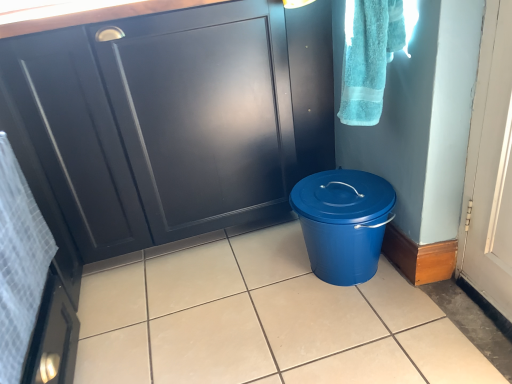
Where is `vacant region to the left of blue plastic bucket at lower right`? vacant region to the left of blue plastic bucket at lower right is located at coordinates (260, 281).